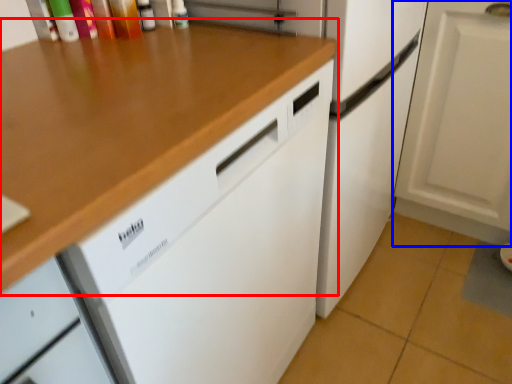
Question: Which of the following is the closest to the observer, countertop (highlighted by a red box) or cabinetry (highlighted by a blue box)?

Choices:
 (A) countertop
 (B) cabinetry

Answer: (A)